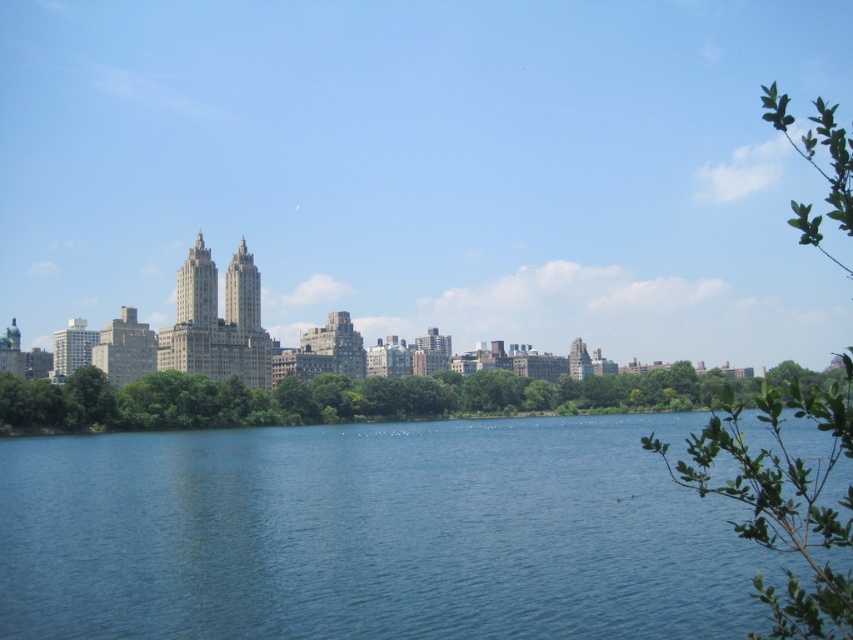
Is blue water at center taller than green leafy trees at center?

Correct, blue water at center is much taller as green leafy trees at center.

Between point (111, 436) and point (488, 380), which one is positioned in front?

Point (111, 436)

Locate an element on the screen. Image resolution: width=853 pixels, height=640 pixels. blue water at center is located at coordinates 372,532.

Which of these two, blue water at center or green leafy branch at upper right, stands shorter?

blue water at center

Which is above, blue water at center or green leafy branch at upper right?

green leafy branch at upper right

The image size is (853, 640). I want to click on blue water at center, so click(x=372, y=532).

You are a GUI agent. You are given a task and a screenshot of the screen. Output one action in this format:
    pyautogui.click(x=<x>, y=<y>)
    Task: Click on the blue water at center
    This screenshot has height=640, width=853.
    Given the screenshot: What is the action you would take?
    pyautogui.click(x=372, y=532)

Does point (45, 416) come behind point (747, 483)?

Yes, it is behind point (747, 483).

Can you confirm if green leafy trees at center is positioned below green leafy branch at upper right?

Yes, green leafy trees at center is below green leafy branch at upper right.

What do you see at coordinates (334, 397) in the screenshot? This screenshot has height=640, width=853. I see `green leafy trees at center` at bounding box center [334, 397].

Where is `green leafy trees at center`? green leafy trees at center is located at coordinates (334, 397).